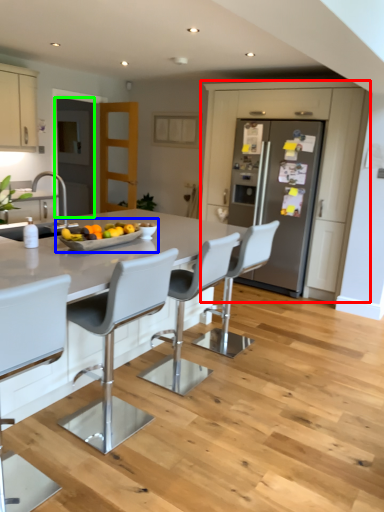
Question: Estimate the real-world distances between objects in this image. Which object is closer to cabinetry (highlighted by a red box), fruit dish (highlighted by a blue box) or glass door (highlighted by a green box)?

Choices:
 (A) fruit dish
 (B) glass door

Answer: (B)